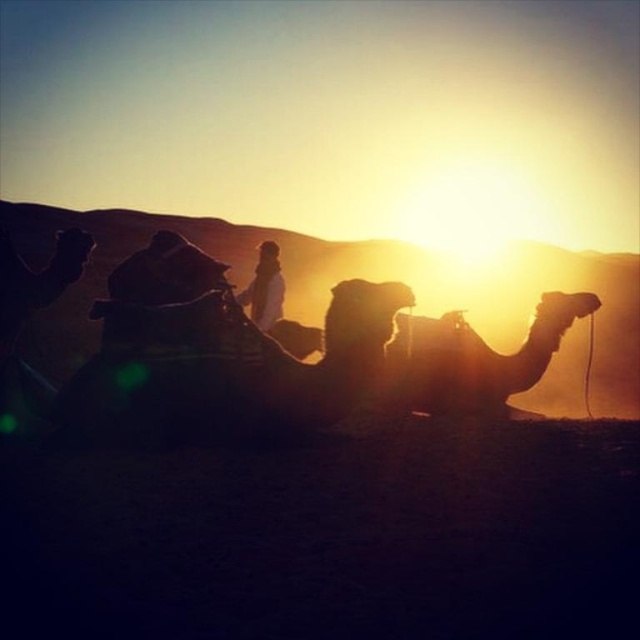
From the picture: You are standing at the point labeled point (433, 360) in the desert scene. The sun is setting behind you. If you walk directly towards the sun, will you move closer to or farther away from the point?

The point labeled point (433, 360) is 9.50 meters away from you. If you walk directly towards the sun, which is behind you, you will be moving away from the point, so you will get farther away from it.

You are a traveler in the desert and see the brown textured camel at center and the white textured clothing at center. Which object is closer to the ground?

The brown textured camel at center is located below the white textured clothing at center, so it is closer to the ground.

You are a traveler in the desert and need to decide which item to take first. You see a brown textured camel at center and a white textured clothing at center. Which one is bigger?

The brown textured camel at center is larger in size compared to the white textured clothing at center, so you should take the brown textured camel at center first if size is a priority.